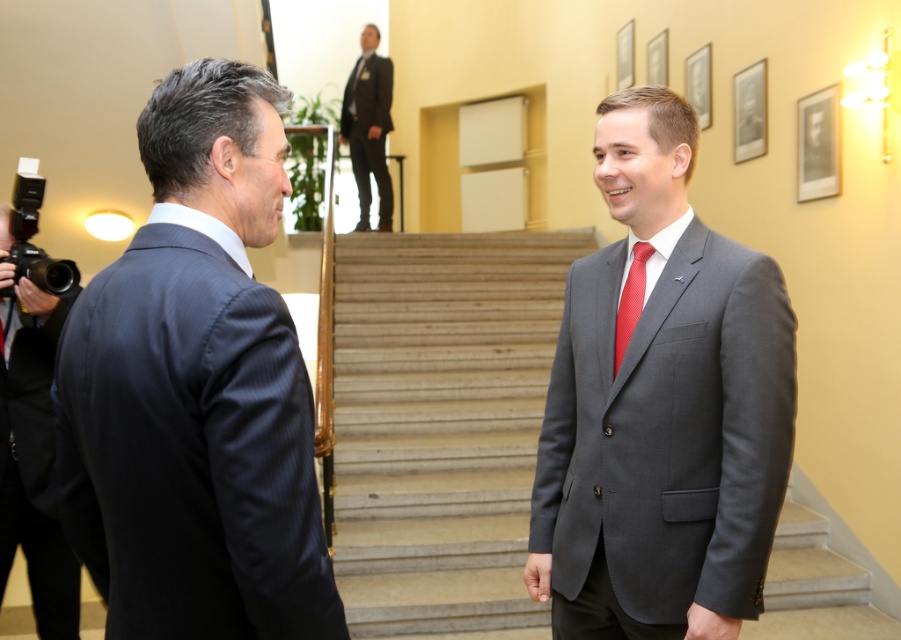
Which is above, smooth stone stairs at center or matte black suit at left?

Positioned higher is smooth stone stairs at center.

Identify the location of smooth stone stairs at center. This screenshot has height=640, width=901. (441, 426).

Between point (440, 561) and point (1, 540), which one is positioned in front?

Point (1, 540) is in front.

You are a GUI agent. You are given a task and a screenshot of the screen. Output one action in this format:
    pyautogui.click(x=<x>, y=<y>)
    Task: Click on the smooth stone stairs at center
    This screenshot has width=901, height=640.
    Given the screenshot: What is the action you would take?
    pyautogui.click(x=441, y=426)

Can you confirm if dark gray wool suit at upper center is shorter than red silk tie at center?

No.

Can you confirm if dark gray wool suit at upper center is positioned below red silk tie at center?

Actually, dark gray wool suit at upper center is above red silk tie at center.

Locate an element on the screen. Image resolution: width=901 pixels, height=640 pixels. dark gray wool suit at upper center is located at coordinates [x=369, y=131].

Where is `dark gray wool suit at upper center`? Image resolution: width=901 pixels, height=640 pixels. dark gray wool suit at upper center is located at coordinates (369, 131).

Can you confirm if dark blue suit at left is positioned above red silk tie at center?

Incorrect, dark blue suit at left is not positioned above red silk tie at center.

Which is in front, point (153, 400) or point (633, 310)?

Point (153, 400) is more forward.

Does point (272, 400) come behind point (630, 336)?

No, it is not.

Locate an element on the screen. The width and height of the screenshot is (901, 640). dark blue suit at left is located at coordinates (196, 392).